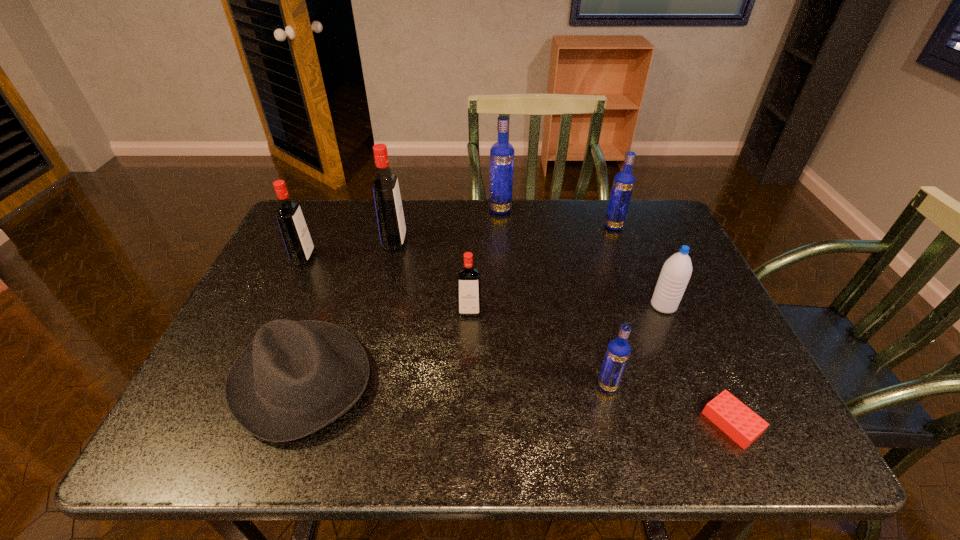
Locate an element on the screen. Image resolution: width=960 pixels, height=540 pixels. the second blue vodka from right to left is located at coordinates (618, 351).

Locate an element on the screen. The width and height of the screenshot is (960, 540). the rightmost red vodka is located at coordinates (468, 279).

The image size is (960, 540). I want to click on the second nearest vodka, so click(x=468, y=279).

The image size is (960, 540). I want to click on the eighth tallest object, so click(296, 377).

This screenshot has height=540, width=960. I want to click on fedora, so tap(296, 377).

This screenshot has width=960, height=540. I want to click on Lego, so click(x=740, y=423).

The image size is (960, 540). I want to click on free space located on the left of the farthest vodka, so click(405, 210).

You are a GUI agent. You are given a task and a screenshot of the screen. Output one action in this format:
    pyautogui.click(x=<x>, y=<y>)
    Task: Click on the free spot located 0.360m on the front and back of the second vodka from left to right
    
    Given the screenshot: What is the action you would take?
    pyautogui.click(x=529, y=242)

Identify the location of vacant area located 0.370m on the left of the rightmost blue vodka. (483, 226).

Locate an element on the screen. Image resolution: width=960 pixels, height=540 pixels. free region located 0.160m on the front and back of the leftmost vodka is located at coordinates (371, 258).